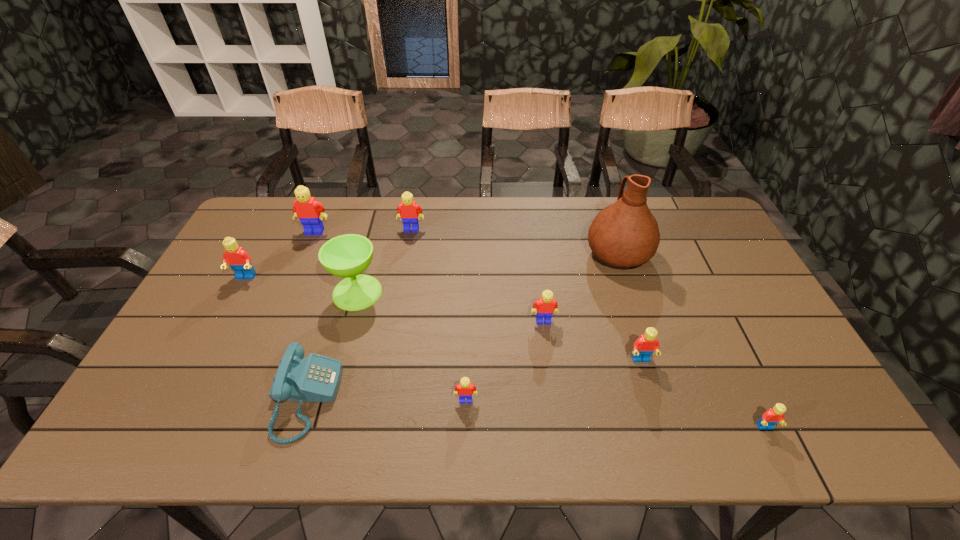
This screenshot has height=540, width=960. What are the coordinates of `pitcher` in the screenshot? It's located at (625, 234).

Where is `the tallest Lego`? the tallest Lego is located at coordinates (310, 212).

This screenshot has height=540, width=960. I want to click on the sixth Lego from right to left, so click(x=310, y=212).

Locate an element on the screen. This screenshot has width=960, height=540. wineglass is located at coordinates (347, 256).

Locate an element on the screen. The height and width of the screenshot is (540, 960). the farthest red Lego is located at coordinates (239, 260).

The height and width of the screenshot is (540, 960). Identify the location of the leftmost Lego. (239, 260).

Where is `the sixth object from right to left`? This screenshot has width=960, height=540. the sixth object from right to left is located at coordinates (408, 210).

This screenshot has height=540, width=960. In order to click on the third smallest yellow Lego in this screenshot , I will do `click(408, 210)`.

Where is `the fifth Lego from left to right`? the fifth Lego from left to right is located at coordinates (546, 305).

Locate an element on the screen. the rightmost yellow Lego is located at coordinates (546, 305).